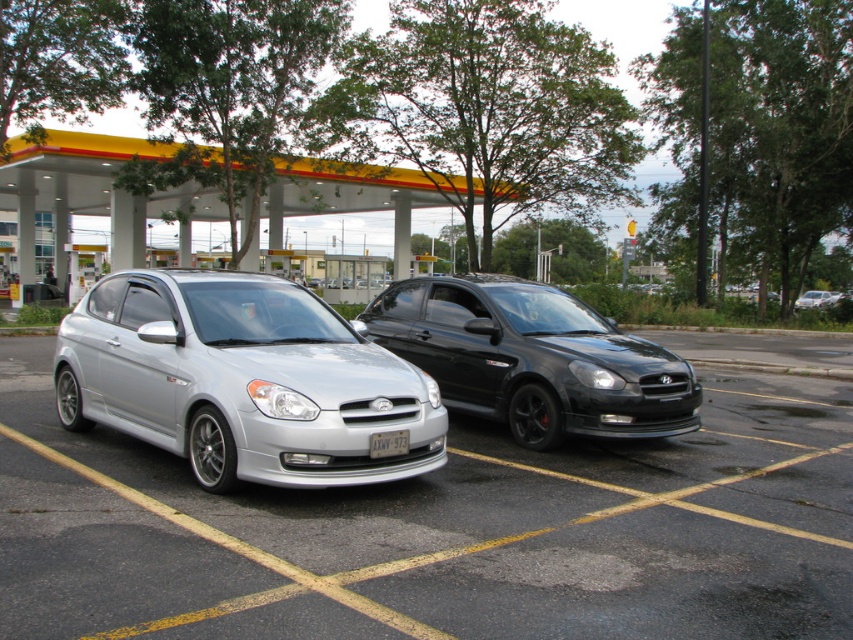
Can you confirm if silver metallic hatchback at center is positioned below glossy black sedan at center?

Yes.

Who is more forward, (x=283, y=440) or (x=622, y=417)?

Point (x=283, y=440) is more forward.

Find the location of a particular element. Image resolution: width=853 pixels, height=640 pixels. silver metallic hatchback at center is located at coordinates (242, 380).

Looking at this image, is white concrete gas station at upper center positioned in front of metallic silver sedan at center?

Yes.

Which is in front, point (22, 172) or point (821, 300)?

Point (22, 172) is more forward.

Locate an element on the screen. white concrete gas station at upper center is located at coordinates (78, 179).

Which is above, glossy black sedan at center or white plastic license plate at center?

glossy black sedan at center is above.

Is glossy black sedan at center positioned at the back of white plastic license plate at center?

Yes, glossy black sedan at center is further from the viewer.

Does point (463, 381) come behind point (370, 454)?

That is True.

I want to click on glossy black sedan at center, so click(x=534, y=358).